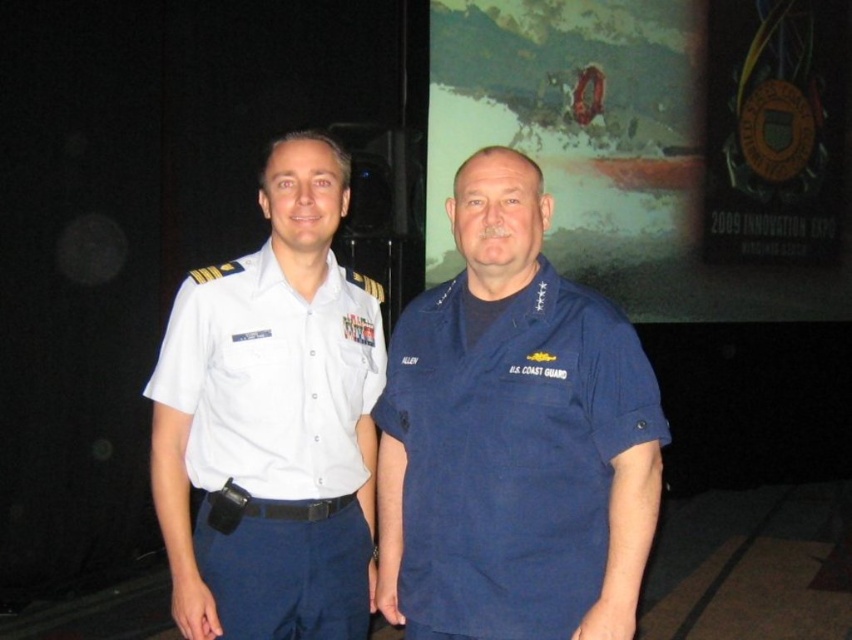
Does navy blue fabric us coast guard uniform at center appear under white cotton shirt at center?

Indeed, navy blue fabric us coast guard uniform at center is positioned under white cotton shirt at center.

Can you confirm if navy blue fabric us coast guard uniform at center is shorter than white cotton shirt at center?

Indeed, navy blue fabric us coast guard uniform at center has a lesser height compared to white cotton shirt at center.

Who is more forward, (389,372) or (240,577)?

Point (240,577) is in front.

This screenshot has height=640, width=852. In order to click on navy blue fabric us coast guard uniform at center in this screenshot , I will do (x=511, y=452).